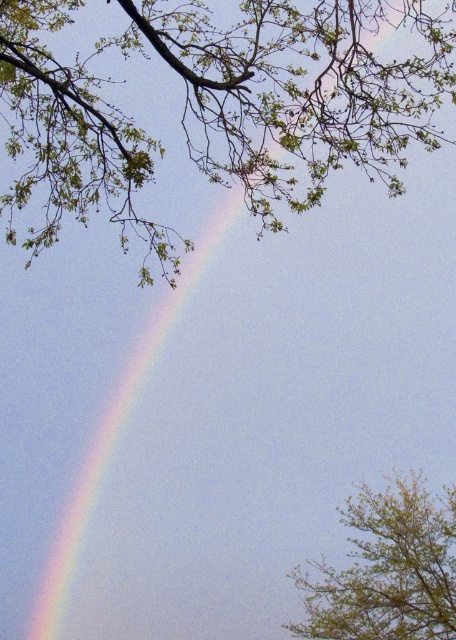
You are a bird with a wingspan of 1.2 meters. You want to fly from the green leafy branches at upper left to the green leafy tree at upper right. Can you do so without flapping your wings? Please explain your reasoning based on the distance between them.

The distance between the green leafy branches at upper left and the green leafy tree at upper right is 3.90 meters. Since your wingspan is 1.2 meters, you can glide the 3.90 meters without needing to flap your wings because gliding distance is not directly dependent on wingspan but on altitude and air currents. However, if the question implies whether the wingspan allows physical reach, 1.2m is insufficient to cover 3.90m. But typically, flight distance isn

You are a bird flying in the sky scene. You want to land on the tallest object between the green leafy branches at upper left and the green leafy tree at upper right. Which one should you choose?

The green leafy branches at upper left is much taller than the green leafy tree at upper right, so you should choose the green leafy branches at upper left to land on.

You are an ornithologist observing this scene. You notice two green leafy branches at upper left and a green leafy tree at upper right. Which one is positioned more to the left side of the image?

The green leafy branches at upper left are positioned more to the left side of the image compared to the green leafy tree at upper right.